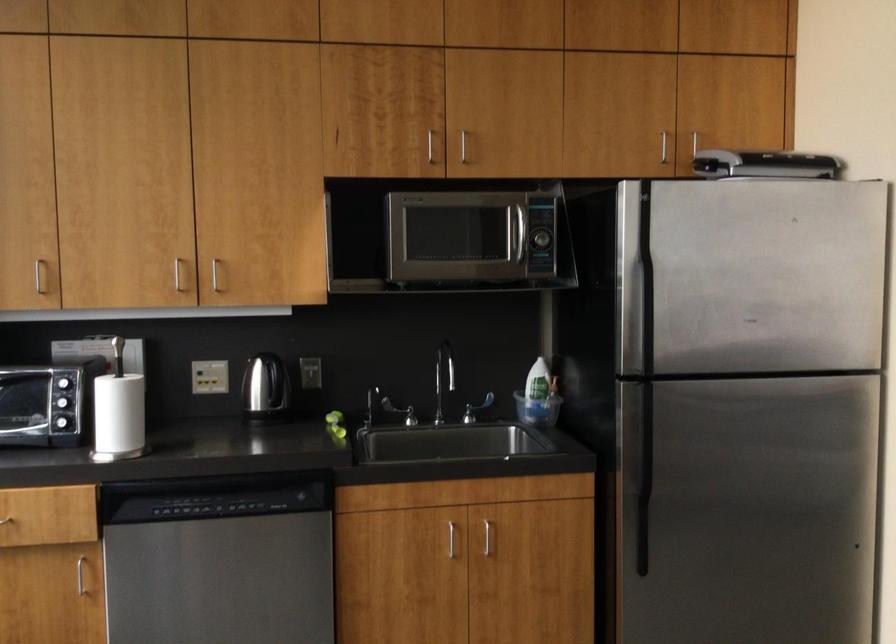
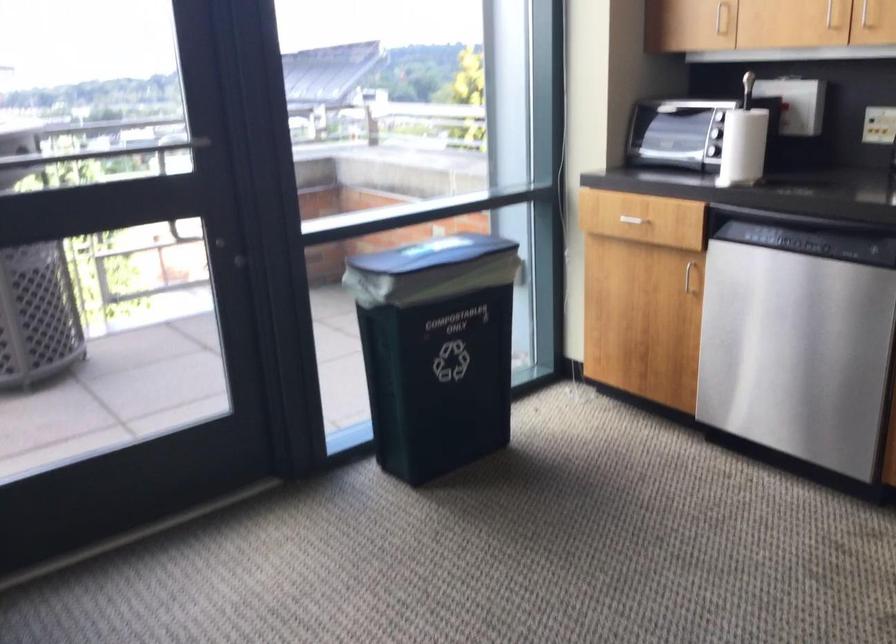
Find the pixel in the second image that matches point (135, 413) in the first image.

(743, 146)